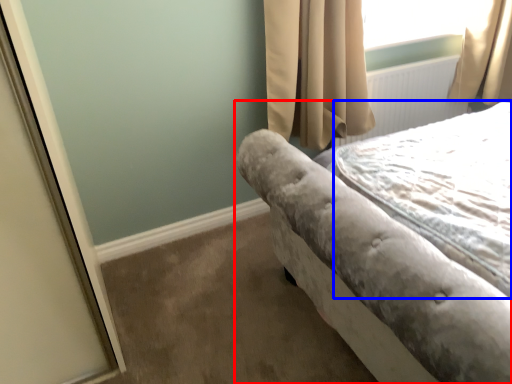
Question: Which point is further to the camera, bed (highlighted by a red box) or sheet (highlighted by a blue box)?

Choices:
 (A) bed
 (B) sheet

Answer: (B)